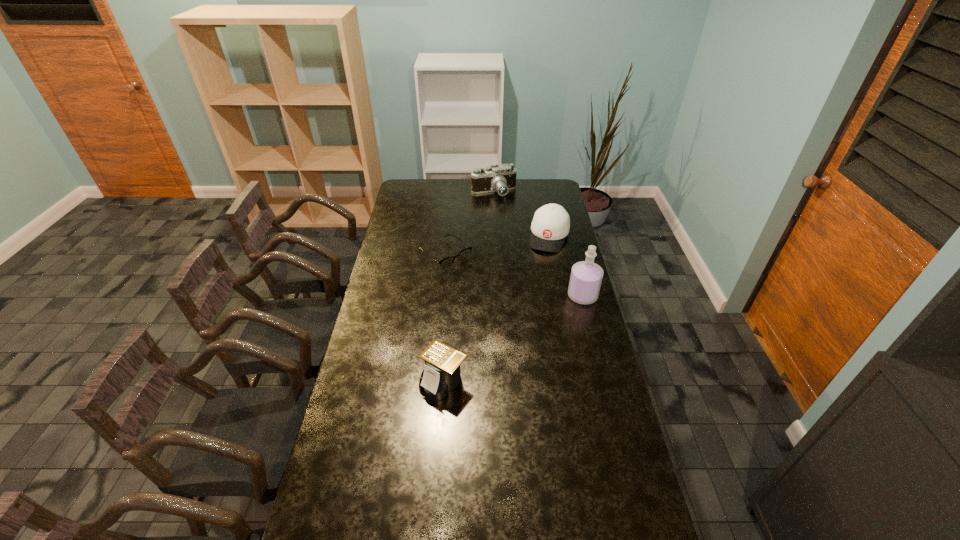
You are a GUI agent. You are given a task and a screenshot of the screen. Output one action in this format:
    pyautogui.click(x=<x>, y=<y>)
    Task: Click on the vacant space at the far edge
    
    Given the screenshot: What is the action you would take?
    pyautogui.click(x=455, y=190)

In the image, there is a desktop. Find the location of `vacant space at the near edge`. vacant space at the near edge is located at coordinates (499, 514).

The width and height of the screenshot is (960, 540). Identify the location of free space at the left edge of the desktop. (386, 262).

This screenshot has width=960, height=540. In the image, there is a desktop. Identify the location of blank space at the right edge. (579, 316).

Locate an element on the screen. Image resolution: width=960 pixels, height=540 pixels. vacant space at the far left corner is located at coordinates (411, 195).

Where is `vacant space at the near left corner of the desktop`? The height and width of the screenshot is (540, 960). vacant space at the near left corner of the desktop is located at coordinates (348, 522).

The width and height of the screenshot is (960, 540). In the image, there is a desktop. Find the location of `free space at the far right corner`. free space at the far right corner is located at coordinates (553, 185).

This screenshot has width=960, height=540. What are the coordinates of `free space between the spectacles and the baseball cap` in the screenshot? It's located at (497, 246).

At what (x,y) coordinates should I click in order to perform the action: click on unoccupied position between the spectacles and the farthest object. Please return your answer as a coordinate pair (x, y). Looking at the image, I should click on (469, 224).

You are a GUI agent. You are given a task and a screenshot of the screen. Output one action in this format:
    pyautogui.click(x=<x>, y=<y>)
    Task: Click on the vacant space that is in between the nearest object and the camera
    
    Given the screenshot: What is the action you would take?
    pyautogui.click(x=468, y=287)